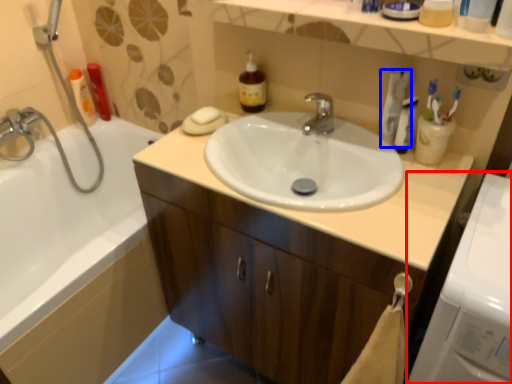
Question: Which of the following is the closest to the observer, washing machine (highlighted by a red box) or toothpaste (highlighted by a blue box)?

Choices:
 (A) washing machine
 (B) toothpaste

Answer: (A)